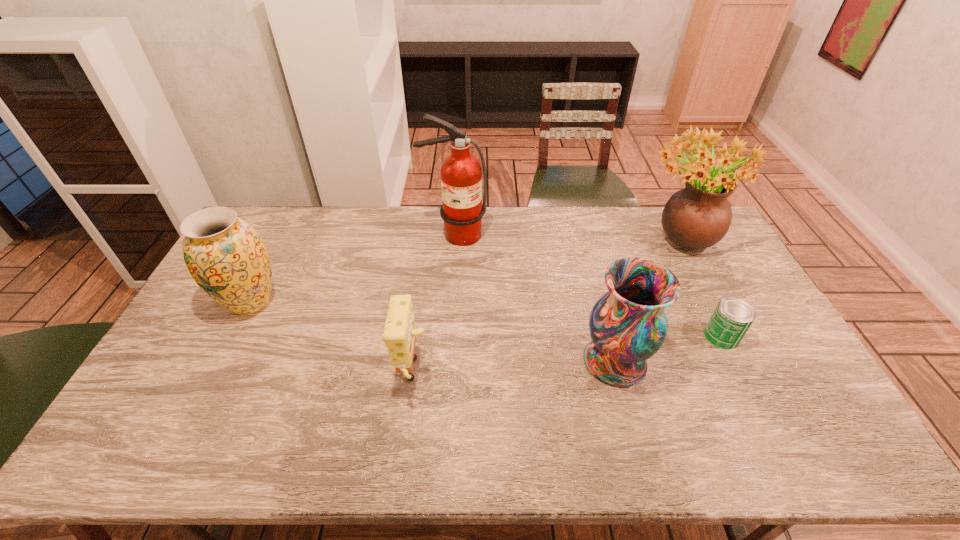
Find the location of a particular element. The height and width of the screenshot is (540, 960). free location located on the front of the left vase is located at coordinates (231, 341).

Identify the location of vacant area situated 0.070m on the back of the right vase. (603, 316).

Image resolution: width=960 pixels, height=540 pixels. What are the coordinates of `vacant area situated on the face of the second shortest object` in the screenshot? It's located at (476, 375).

You are a GUI agent. You are given a task and a screenshot of the screen. Output one action in this format:
    pyautogui.click(x=<x>, y=<y>)
    Task: Click on the blank space located 0.360m on the left of the can
    
    Given the screenshot: What is the action you would take?
    pyautogui.click(x=583, y=336)

Locate an element on the screen. This screenshot has height=540, width=960. fire extinguisher that is positioned at the far edge is located at coordinates (461, 174).

Find the location of a particular element. This screenshot has width=960, height=540. flower arrangement present at the far edge is located at coordinates (696, 217).

Locate an element on the screen. object that is at the left edge is located at coordinates (227, 258).

This screenshot has width=960, height=540. I want to click on flower arrangement that is at the right edge, so pyautogui.click(x=696, y=217).

Where is `can present at the right edge`? The image size is (960, 540). can present at the right edge is located at coordinates (731, 319).

The height and width of the screenshot is (540, 960). I want to click on object located in the far right corner section of the desktop, so click(x=696, y=217).